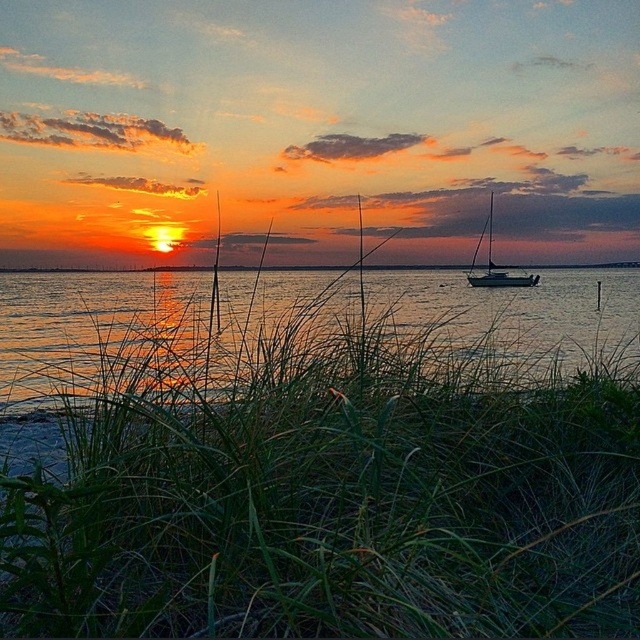
You are an artist trying to paint the sunset scene. You need to decide which object, the shiny reflective water at center or the satin white sailboat at right, should be wider in your painting to maintain accuracy. Which one should you make wider?

You should make the shiny reflective water at center wider than the satin white sailboat at right because the shiny reflective water at center is wider than the satin white sailboat at right according to the description.